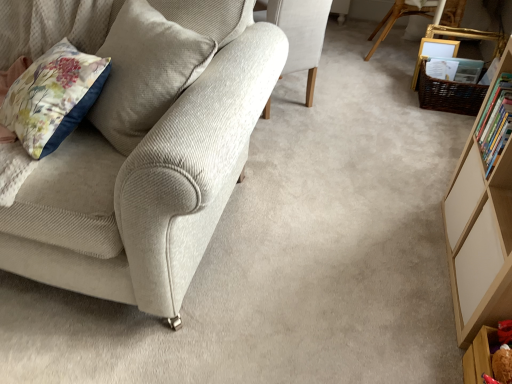
Find the location of a particular element. woven brown basket at upper right is located at coordinates (449, 94).

This screenshot has height=384, width=512. I want to click on wooden picture frame at upper right, so click(434, 53).

Find the location of a particular element. wooden chair at upper center, the 3th chair viewed from the front is located at coordinates (396, 20).

Could you tell me if hardcover book at right is turned towards light wood bookcase at right?

Yes, hardcover book at right is aimed at light wood bookcase at right.

Considering the sizes of objects hardcover book at right and light wood bookcase at right in the image provided, who is smaller, hardcover book at right or light wood bookcase at right?

hardcover book at right is smaller.

Which object is thinner, hardcover book at right or light wood bookcase at right?

hardcover book at right.

Is hardcover book at right located outside light wood bookcase at right?

No.

Is light beige fabric chair at center, which appears as the 2th chair when viewed from the back, smaller than woven brown basket at upper right?

Incorrect, light beige fabric chair at center, which appears as the 2th chair when viewed from the back, is not smaller in size than woven brown basket at upper right.

Where is `basket that appears below the light beige fabric chair at center, the second chair in the right-to-left sequence (from the image's perspective)`? basket that appears below the light beige fabric chair at center, the second chair in the right-to-left sequence (from the image's perspective) is located at coordinates (449, 94).

Considering the positions of objects light beige fabric chair at center, placed as the second chair when sorted from front to back, and woven brown basket at upper right in the image provided, who is more to the right, light beige fabric chair at center, placed as the second chair when sorted from front to back, or woven brown basket at upper right?

woven brown basket at upper right.

Does point (426, 48) appear closer or farther from the camera than point (470, 229)?

Point (426, 48) is farther from the camera than point (470, 229).

Can you confirm if wooden picture frame at upper right is positioned to the left of light wood bookcase at right?

No.

From a real-world perspective, is wooden picture frame at upper right physically located above or below light wood bookcase at right?

From a real-world perspective, wooden picture frame at upper right is physically below light wood bookcase at right.

Is hardcover book at right next to wooden shelf at lower right?

hardcover book at right and wooden shelf at lower right are not in contact.

From a real-world perspective, who is located lower, hardcover book at right or wooden shelf at lower right?

In real-world perspective, wooden shelf at lower right is lower.

Is hardcover book at right located outside wooden shelf at lower right?

hardcover book at right is positioned outside wooden shelf at lower right.

Considering the relative sizes of wooden chair at upper center, which is the 1th chair from right to left, and hardcover book at right in the image provided, is wooden chair at upper center, which is the 1th chair from right to left, shorter than hardcover book at right?

No, wooden chair at upper center, which is the 1th chair from right to left, is not shorter than hardcover book at right.

Is wooden chair at upper center, the 3th chair viewed from the front, inside or outside of hardcover book at right?

The correct answer is: outside.

Does wooden chair at upper center, the 3th chair viewed from the front, have a smaller size compared to hardcover book at right?

Actually, wooden chair at upper center, the 3th chair viewed from the front, might be larger than hardcover book at right.

Is wooden chair at upper center, which is the 3th chair from left to right, facing away from hardcover book at right?

No, wooden chair at upper center, which is the 3th chair from left to right, is not facing the opposite direction of hardcover book at right.

Is point (306, 39) positioned in front of point (476, 338)?

No, (306, 39) is behind (476, 338).

Between light beige fabric chair at center, acting as the 2th chair starting from the left, and wooden shelf at lower right, which one appears on the left side from the viewer's perspective?

Positioned to the left is light beige fabric chair at center, acting as the 2th chair starting from the left.

From the image's perspective, is light beige fabric chair at center, acting as the 2th chair starting from the left, below wooden shelf at lower right?

No, from the image's perspective, light beige fabric chair at center, acting as the 2th chair starting from the left, is not beneath wooden shelf at lower right.

Which object is wider, light beige corduroy chair at left, acting as the 1th chair starting from the front, or wooden picture frame at upper right?

light beige corduroy chair at left, acting as the 1th chair starting from the front, is wider.

Could wooden picture frame at upper right be considered to be inside light beige corduroy chair at left, marked as the 3th chair in a back-to-front arrangement?

No, wooden picture frame at upper right is not surrounded by light beige corduroy chair at left, marked as the 3th chair in a back-to-front arrangement.

Considering the points (130, 283) and (437, 45), which point is behind, point (130, 283) or point (437, 45)?

The point (437, 45) is behind.

I want to click on the 3rd chair directly above the wooden picture frame at upper right (from a real-world perspective), so click(145, 189).

Identify the location of book above the light wood bookcase at right (from a real-world perspective). The width and height of the screenshot is (512, 384). (495, 122).

This screenshot has width=512, height=384. I want to click on basket behind the light beige fabric chair at center, acting as the 2th chair starting from the left, so click(449, 94).

When comparing their distances from light beige fabric chair at center, which appears as the 2th chair when viewed from the back, does wooden picture frame at upper right or wooden shelf at lower right seem further?

Based on the image, wooden shelf at lower right appears to be further to light beige fabric chair at center, which appears as the 2th chair when viewed from the back.

Looking at the image, which one is located further to woven brown basket at upper right, wooden shelf at lower right or wooden picture frame at upper right?

wooden shelf at lower right is further to woven brown basket at upper right.

Based on the photo, looking at the image, which one is located further to wooden shelf at lower right, hardcover book at right or light beige corduroy chair at left, the 3th chair from the right?

Among the two, light beige corduroy chair at left, the 3th chair from the right, is located further to wooden shelf at lower right.

Estimate the real-world distances between objects in this image. Which object is closer to woven brown basket at upper right, wooden chair at upper center, which is the 1th chair from right to left, or light beige corduroy chair at left, marked as the 3th chair in a back-to-front arrangement?

Based on the image, wooden chair at upper center, which is the 1th chair from right to left, appears to be nearer to woven brown basket at upper right.

Based on their spatial positions, is light beige fabric chair at center, the second chair in the right-to-left sequence, or light beige corduroy chair at left, acting as the 1th chair starting from the front, further from light wood bookcase at right?

The object further to light wood bookcase at right is light beige fabric chair at center, the second chair in the right-to-left sequence.

Estimate the real-world distances between objects in this image. Which object is further from light beige corduroy chair at left, the 3th chair from the right, woven brown basket at upper right or wooden picture frame at upper right?

Based on the image, wooden picture frame at upper right appears to be further to light beige corduroy chair at left, the 3th chair from the right.

Which object lies nearer to the anchor point light beige fabric chair at center, which appears as the 2th chair when viewed from the back, wooden chair at upper center, which is the 3th chair from left to right, or wooden shelf at lower right?

Among the two, wooden chair at upper center, which is the 3th chair from left to right, is located nearer to light beige fabric chair at center, which appears as the 2th chair when viewed from the back.

When comparing their distances from light beige corduroy chair at left, marked as the 3th chair in a back-to-front arrangement, does wooden picture frame at upper right or wooden shelf at lower right seem closer?

Based on the image, wooden shelf at lower right appears to be nearer to light beige corduroy chair at left, marked as the 3th chair in a back-to-front arrangement.

What are the coordinates of `bookcase located between light beige corduroy chair at left, marked as the 3th chair in a back-to-front arrangement, and woven brown basket at upper right in the left-right direction` in the screenshot? It's located at (481, 230).

Locate an element on the screen. The height and width of the screenshot is (384, 512). chair between light beige fabric chair at center, placed as the second chair when sorted from front to back, and woven brown basket at upper right is located at coordinates click(x=396, y=20).

The height and width of the screenshot is (384, 512). In order to click on bookcase between light beige fabric chair at center, acting as the 2th chair starting from the left, and wooden shelf at lower right from top to bottom in this screenshot , I will do [481, 230].

The image size is (512, 384). Find the location of `book located between light beige fabric chair at center, which appears as the 2th chair when viewed from the back, and woven brown basket at upper right in the left-right direction`. book located between light beige fabric chair at center, which appears as the 2th chair when viewed from the back, and woven brown basket at upper right in the left-right direction is located at coordinates (495, 122).